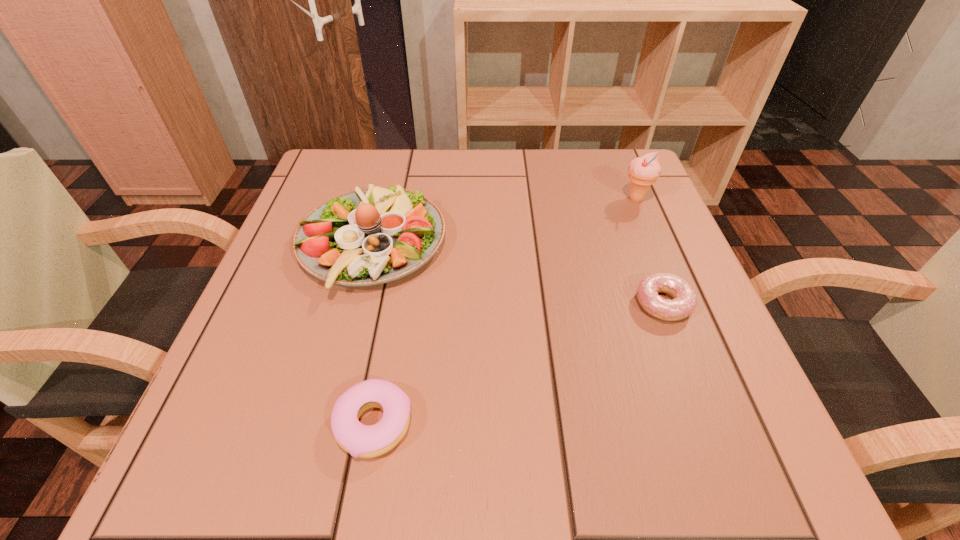
Locate an element on the screen. The width and height of the screenshot is (960, 540). free point between the tallest object and the third shortest object is located at coordinates (504, 221).

The height and width of the screenshot is (540, 960). What are the coordinates of `vacant area that lies between the third shortest object and the nearest object` in the screenshot? It's located at (372, 334).

I want to click on empty space that is in between the left doughnut and the farther doughnut, so click(518, 364).

Locate an element on the screen. The height and width of the screenshot is (540, 960). object that stands as the closest to the nearer doughnut is located at coordinates (372, 236).

Identify the location of the third closest object to the icecream. (366, 441).

Identify the location of vacant space that satisfies the following two spatial constraints: 1. on the back side of the left doughnut; 2. on the right side of the tallest object. (414, 199).

This screenshot has width=960, height=540. Identify the location of vacant space that satisfies the following two spatial constraints: 1. on the front side of the nearer doughnut; 2. on the left side of the salad plate. (326, 424).

At what (x,y) coordinates should I click in order to perform the action: click on free point that satisfies the following two spatial constraints: 1. on the back side of the farther doughnut; 2. on the left side of the tallest object. Please return your answer as a coordinate pair (x, y). This screenshot has width=960, height=540. Looking at the image, I should click on [623, 199].

You are a GUI agent. You are given a task and a screenshot of the screen. Output one action in this format:
    pyautogui.click(x=<x>, y=<y>)
    Task: Click on the blank area in the image that satisfies the following two spatial constraints: 1. on the back side of the second tallest object; 2. on the right side of the icecream
    This screenshot has height=540, width=960.
    Given the screenshot: What is the action you would take?
    pyautogui.click(x=383, y=199)

Locate an element on the screen. free spot that satisfies the following two spatial constraints: 1. on the front side of the left doughnut; 2. on the right side of the third shortest object is located at coordinates (326, 424).